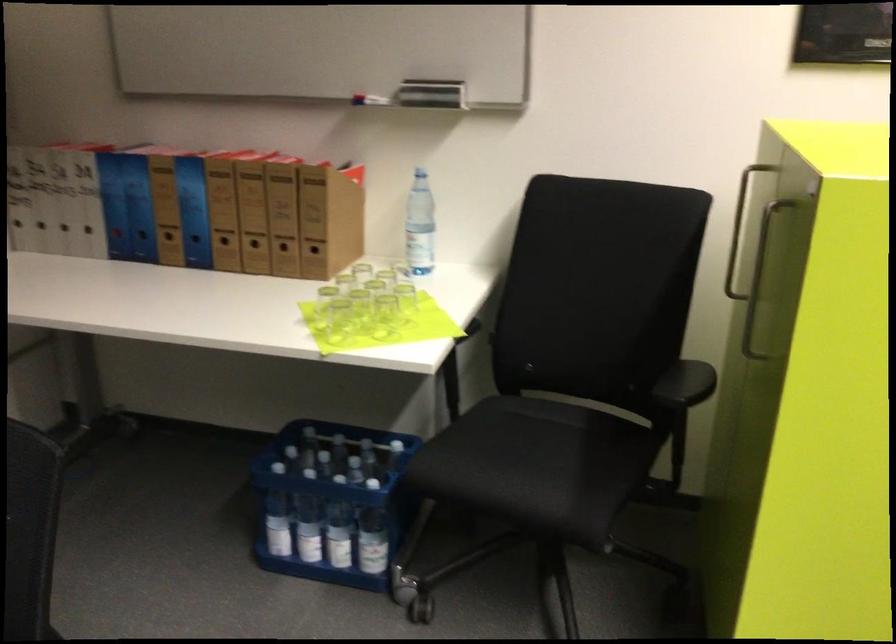
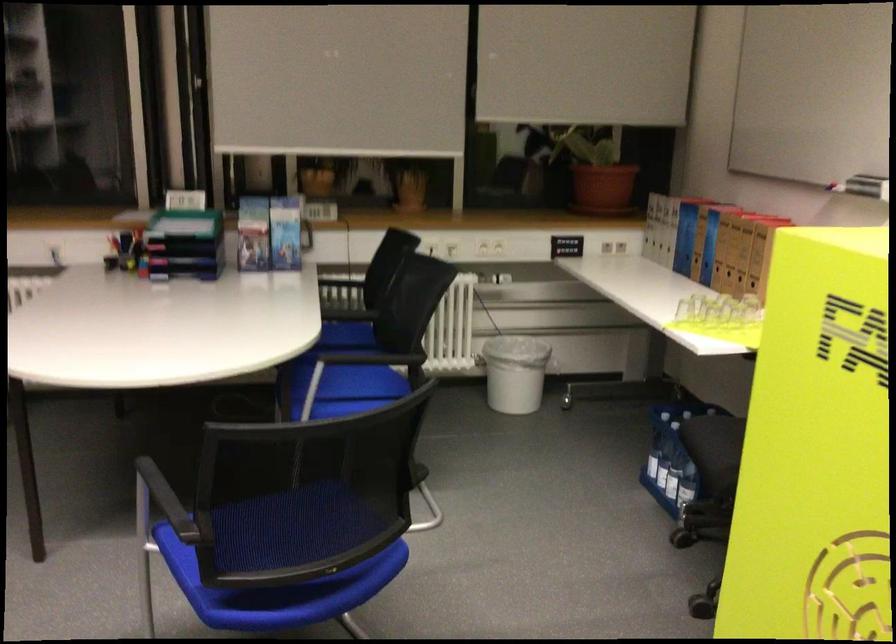
Where in the second image is the point corresponding to point (248, 219) from the first image?

(730, 251)